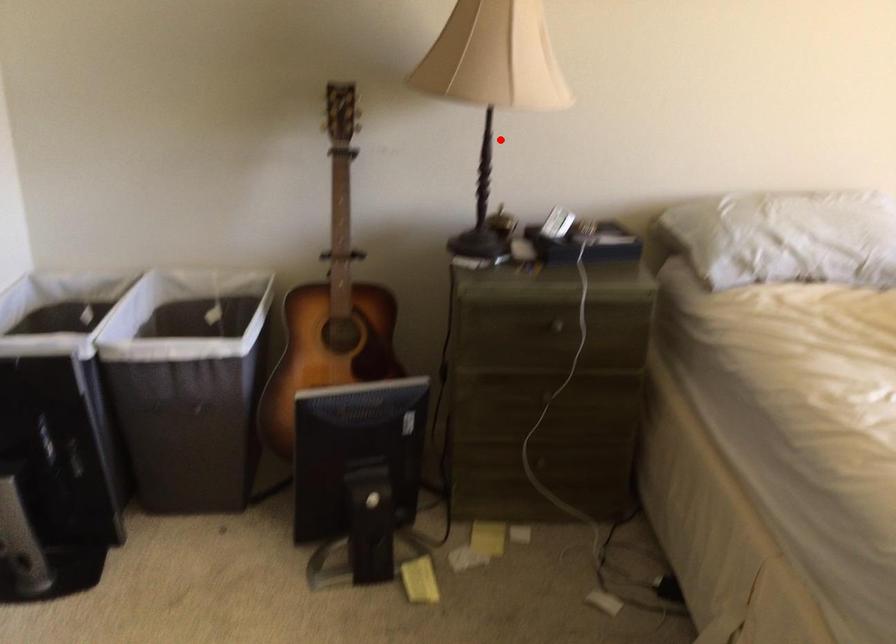
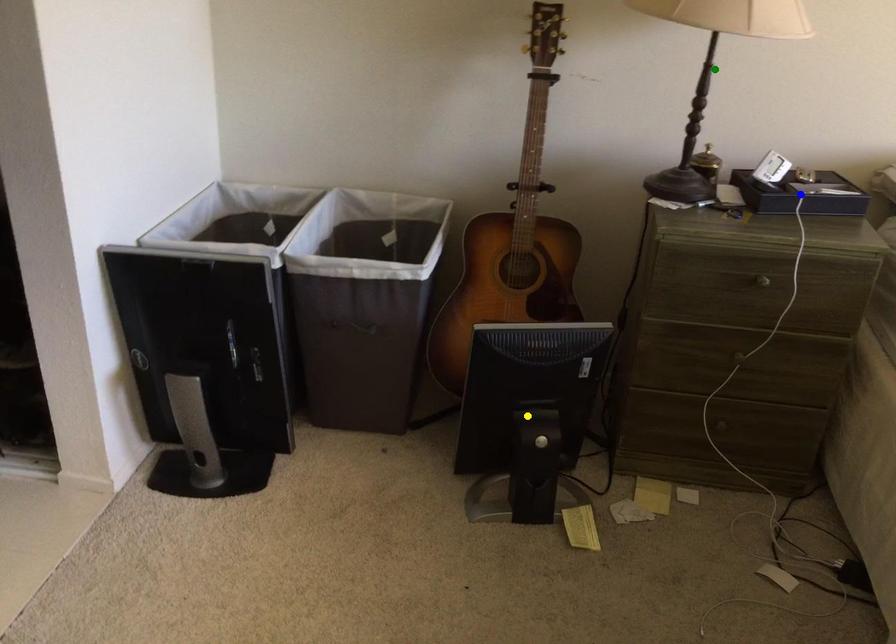
Question: I am providing you with two images of the same scene from different viewpoints. A red point is marked on the first image. You are given multiple points on the second image. Can you choose the point in image 2 that corresponds to the point in image 1?

Choices:
 (A) green point
 (B) blue point
 (C) yellow point

Answer: (A)